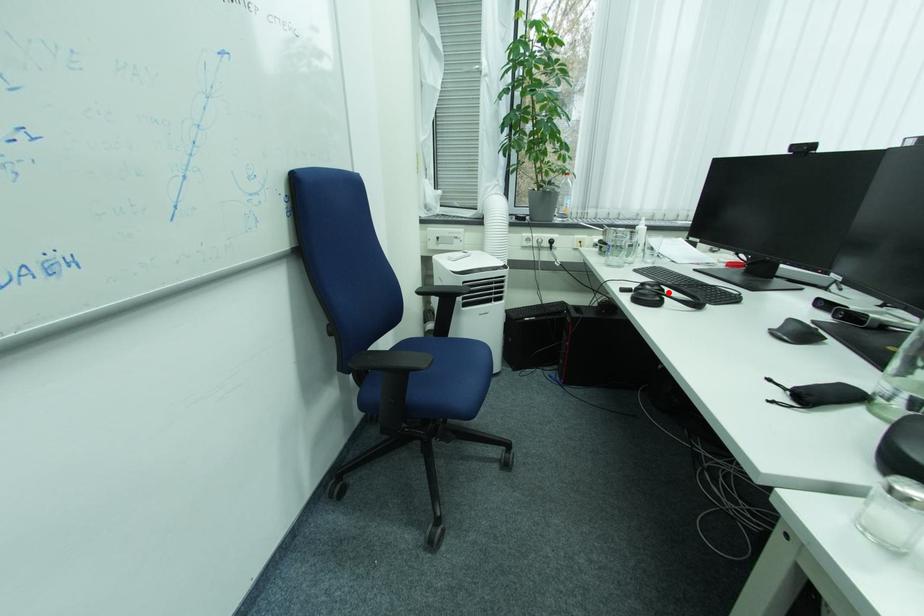
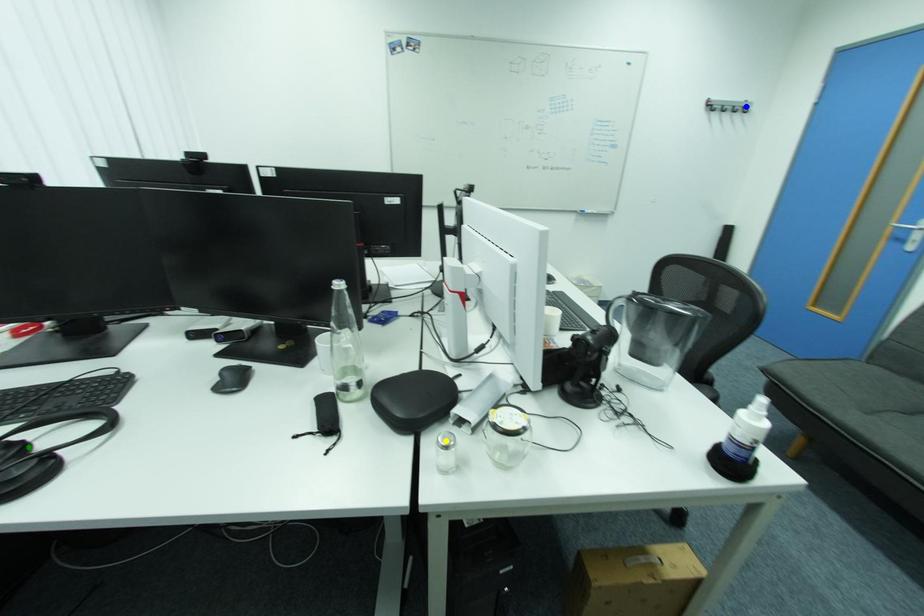
Question: I am providing you with two images of the same scene from different viewpoints. A red point is marked on the first image. You are given multiple points on the second image. Which point in image 2 is actually the same real-world point as the red point in image 1?

Choices:
 (A) yellow point
 (B) green point
 (C) blue point

Answer: (B)